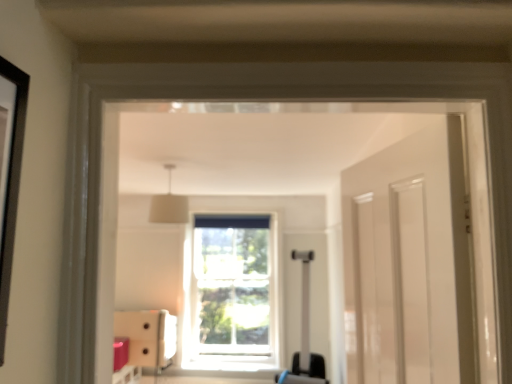
Question: Does point (167, 187) appear closer or farther from the camera than point (187, 365)?

Choices:
 (A) farther
 (B) closer

Answer: (B)

Question: Looking at the image, does white fabric lampshade at upper center seem bigger or smaller compared to clear glass window at center?

Choices:
 (A) big
 (B) small

Answer: (B)

Question: Which object is the closest to the clear glass window at center?

Choices:
 (A) matte white cabinet at lower left
 (B) white fabric lampshade at upper center
 (C) matte black suitcase at center

Answer: (A)

Question: Based on their relative distances, which object is farther from the matte black suitcase at center?

Choices:
 (A) white fabric lampshade at upper center
 (B) matte white cabinet at lower left
 (C) clear glass window at center

Answer: (A)